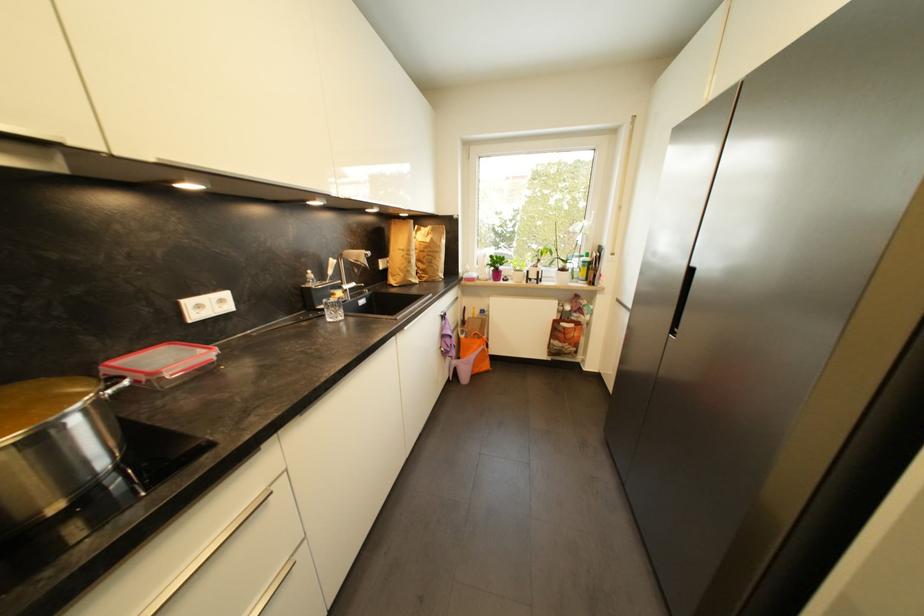
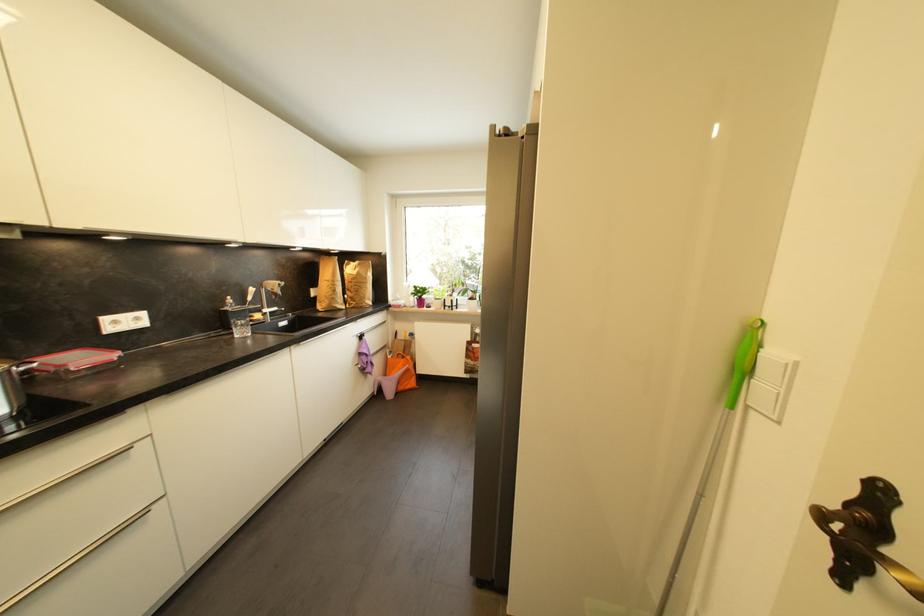
Where in the second image is the point corresponding to point 136,354 from the first image?

(54, 355)